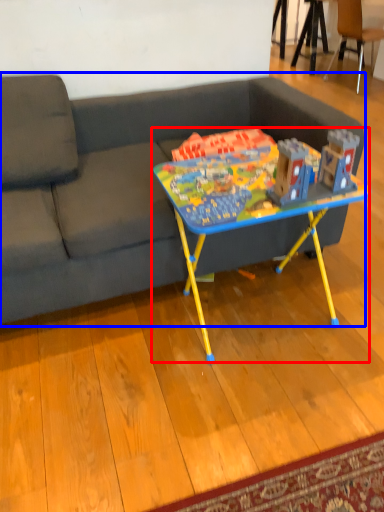
Question: Which point is further to the camera, table (highlighted by a red box) or studio couch (highlighted by a blue box)?

Choices:
 (A) table
 (B) studio couch

Answer: (A)